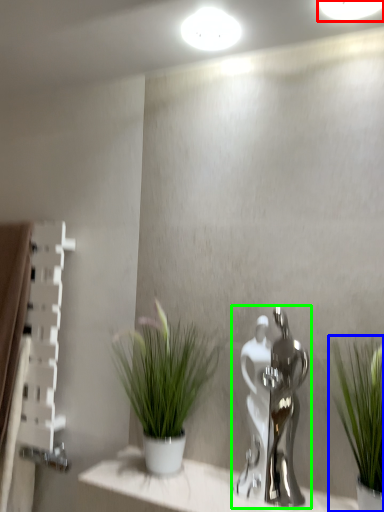
Question: Which object is the closest to the lighting (highlighted by a red box)? Choose among these: houseplant (highlighted by a blue box) or tap (highlighted by a green box).

Choices:
 (A) houseplant
 (B) tap

Answer: (A)